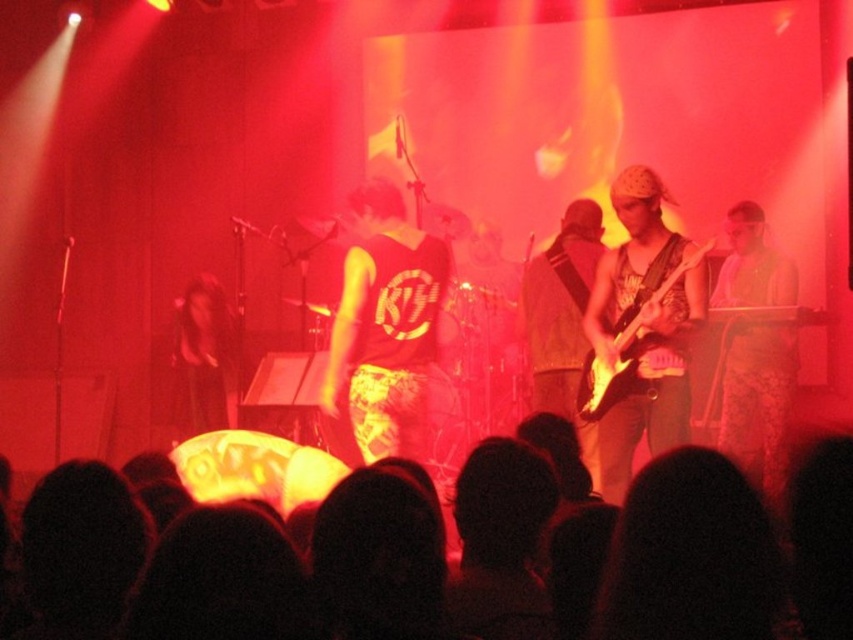
You are a photographer at the back of the stage. You want to take a photo of the yellow fabric shirt at center and the patterned fabric dress at right. Which one is wider in the image?

The yellow fabric shirt at center might be wider than patterned fabric dress at right.

In the scene shown: You are a photographer standing at the center of the stage. You want to take a photo of the silhouette crowd at lower center. Where should you point your camera to capture them in the frame?

The silhouette crowd at lower center is located at the 2D coordinates point [688,548], so you should point your camera towards that coordinate to capture them in the frame.

You are a photographer at the concert. You want to take a photo of the yellow fabric shirt at center and the patterned fabric dress at right. Which one is positioned to the left?

The yellow fabric shirt at center is positioned to the left of the patterned fabric dress at right.